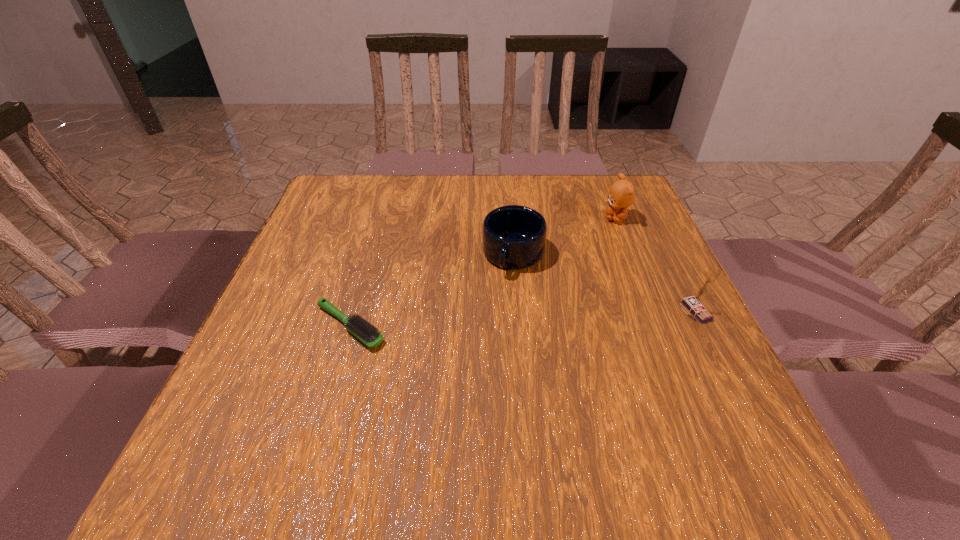
Find the location of `blank space located 0.100m with the handle on the side of the second shortest object`. blank space located 0.100m with the handle on the side of the second shortest object is located at coordinates (492, 308).

This screenshot has width=960, height=540. What are the coordinates of `vacant space positioned with the handle on the side of the second shortest object` in the screenshot? It's located at (486, 321).

Identify the location of vacant space located on the face of the third object from left to right. (589, 253).

Locate an element on the screen. The width and height of the screenshot is (960, 540). vacant area situated 0.320m on the face of the third object from left to right is located at coordinates (555, 296).

Image resolution: width=960 pixels, height=540 pixels. Find the location of `free space located on the face of the third object from left to right`. free space located on the face of the third object from left to right is located at coordinates (585, 260).

Locate an element on the screen. The width and height of the screenshot is (960, 540). object located at the far edge is located at coordinates (622, 193).

The width and height of the screenshot is (960, 540). I want to click on object that is at the left edge, so click(368, 334).

Locate an element on the screen. matchbox at the right edge is located at coordinates (694, 303).

I want to click on teddy bear that is at the right edge, so click(x=622, y=193).

This screenshot has height=540, width=960. Identify the location of object located in the far right corner section of the desktop. (622, 193).